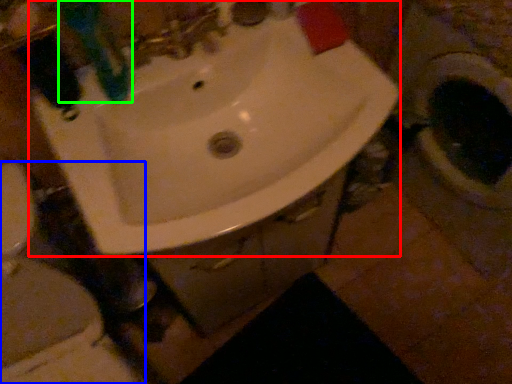
Question: Which is nearer to the sink (highlighted by a red box)? toilet (highlighted by a blue box) or toothbrush (highlighted by a green box).

Choices:
 (A) toilet
 (B) toothbrush

Answer: (B)